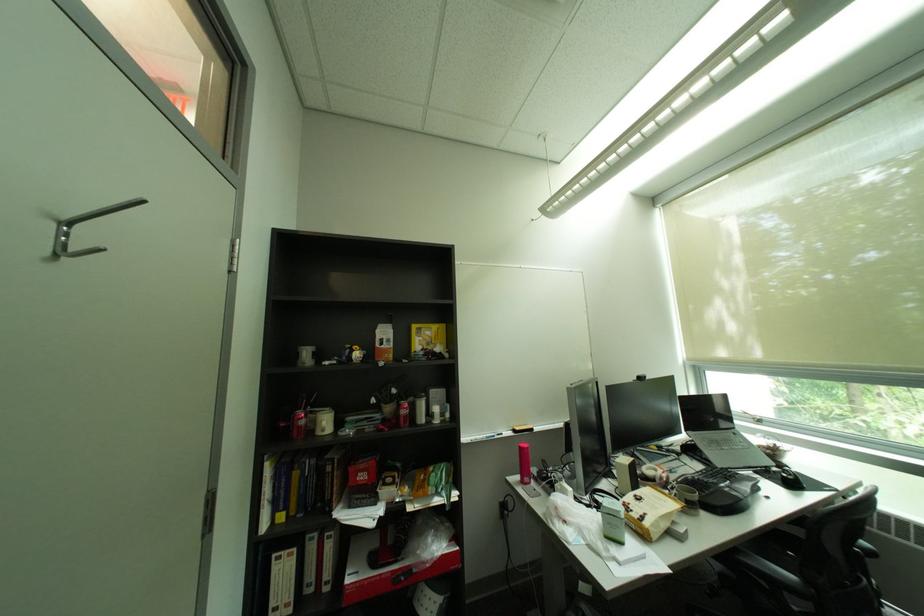
This screenshot has width=924, height=616. I want to click on black computer mouse, so click(x=789, y=477).